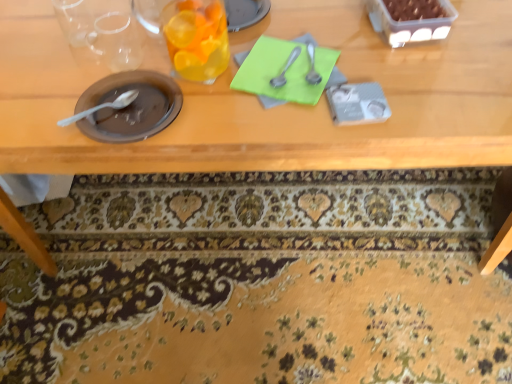
Where is `vacant area that lies to the right of green paper at center`? This screenshot has width=512, height=384. vacant area that lies to the right of green paper at center is located at coordinates (402, 77).